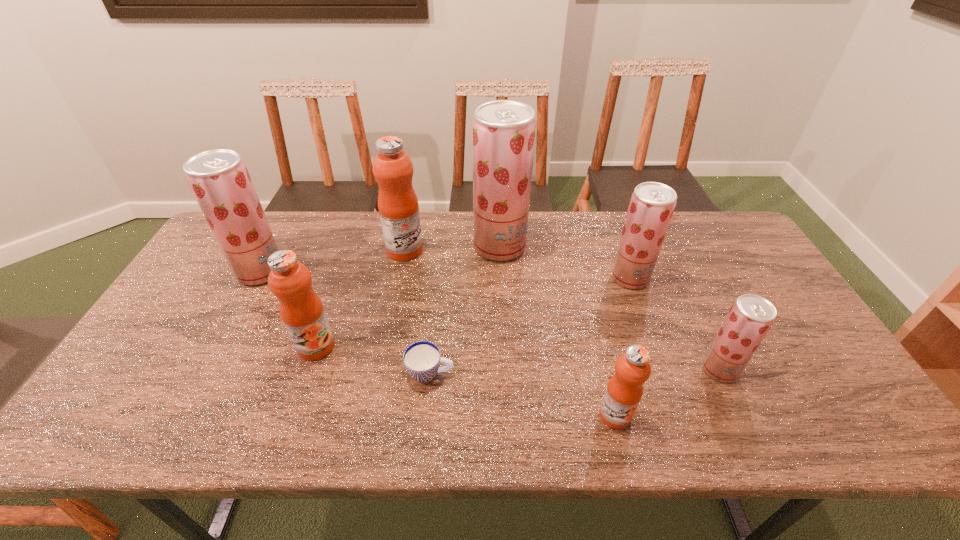
This screenshot has width=960, height=540. Identify the location of the tallest fruit juice. (504, 131).

Locate an element on the screen. the fifth object from left to right is located at coordinates (504, 131).

Locate an element on the screen. The height and width of the screenshot is (540, 960). the leftmost strawberry fruit juice is located at coordinates (219, 179).

Locate an element on the screen. Image resolution: width=960 pixels, height=540 pixels. the leftmost object is located at coordinates (219, 179).

Locate an element on the screen. The width and height of the screenshot is (960, 540). the farthest orange fruit juice is located at coordinates (398, 207).

You are a GUI agent. You are given a task and a screenshot of the screen. Output one action in this format:
    pyautogui.click(x=<x>, y=<y>)
    Task: Click on the third object from left to right
    The image size is (960, 540).
    Given the screenshot: What is the action you would take?
    pyautogui.click(x=398, y=207)

The width and height of the screenshot is (960, 540). I want to click on the second strawberry fruit juice from right to left, so click(652, 204).

Identify the location of the sixth fruit juice from left to right. (652, 204).

This screenshot has height=540, width=960. Find the location of `the leftmost orange fruit juice`. the leftmost orange fruit juice is located at coordinates (301, 309).

Find the location of a particular element. the seventh object from right to left is located at coordinates (301, 309).